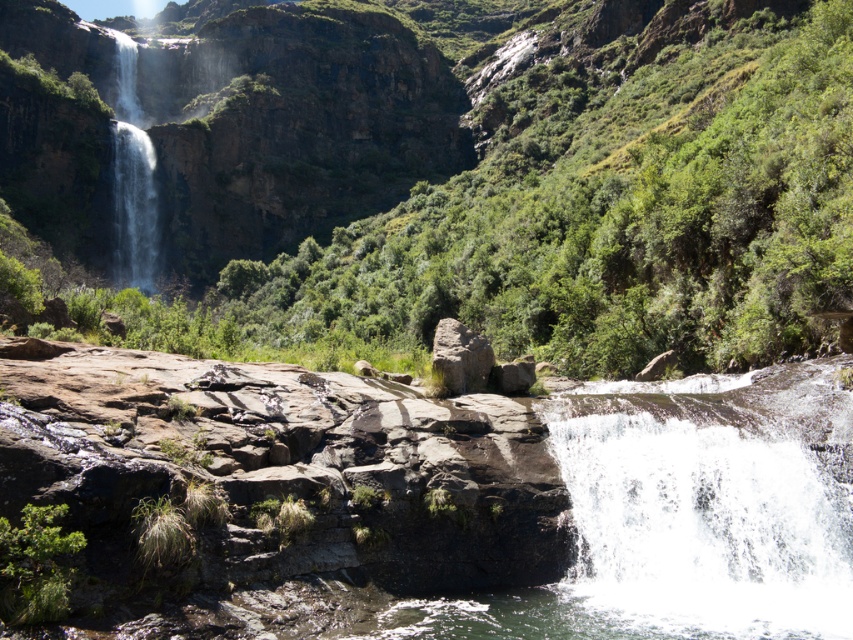
Question: Does white frothy water at upper left have a smaller size compared to rusty rock at center?

Choices:
 (A) yes
 (B) no

Answer: (B)

Question: Which object is the closest to the white frothy water at lower right?

Choices:
 (A) white frothy water at upper left
 (B) rusty rock at center

Answer: (B)

Question: Does white frothy water at lower right lie behind rusty rock at center?

Choices:
 (A) no
 (B) yes

Answer: (A)

Question: Does white frothy water at lower right lie behind white frothy water at upper left?

Choices:
 (A) yes
 (B) no

Answer: (B)

Question: Which point is farther to the camera?

Choices:
 (A) rusty rock at center
 (B) white frothy water at upper left

Answer: (B)

Question: Which object is positioned closest to the rusty rock at center?

Choices:
 (A) white frothy water at upper left
 (B) white frothy water at lower right

Answer: (B)